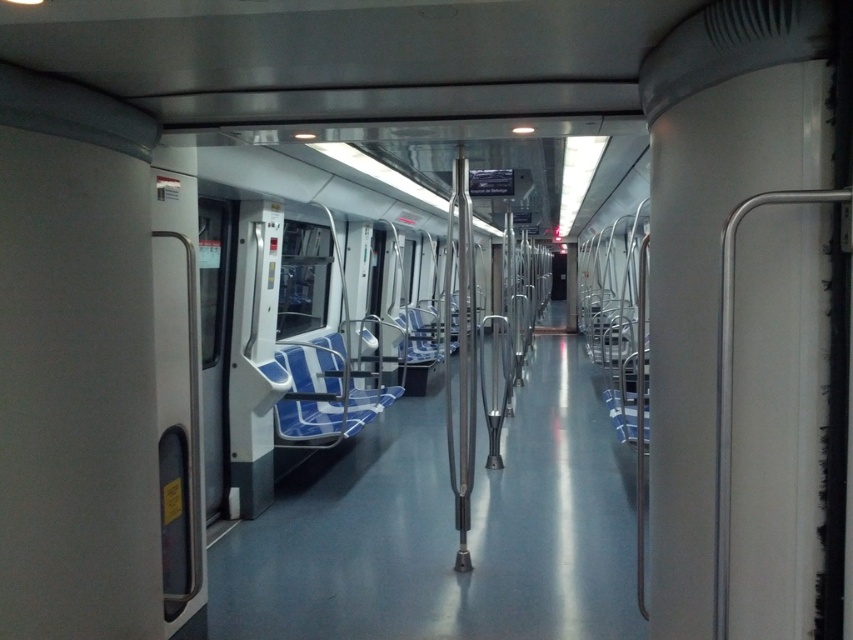
Question: Is blue fabric chair at center closer to the viewer compared to blue fabric seat at center?

Choices:
 (A) no
 (B) yes

Answer: (B)

Question: Among these objects, which one is farthest from the camera?

Choices:
 (A) blue fabric seat at center
 (B) blue fabric chair at center

Answer: (A)

Question: In this image, where is blue fabric chair at center located relative to blue fabric seat at center?

Choices:
 (A) above
 (B) below

Answer: (A)

Question: Among these objects, which one is farthest from the camera?

Choices:
 (A) blue fabric seat at center
 (B) blue fabric chair at center

Answer: (A)

Question: Does blue fabric chair at center come in front of blue fabric seat at center?

Choices:
 (A) no
 (B) yes

Answer: (B)